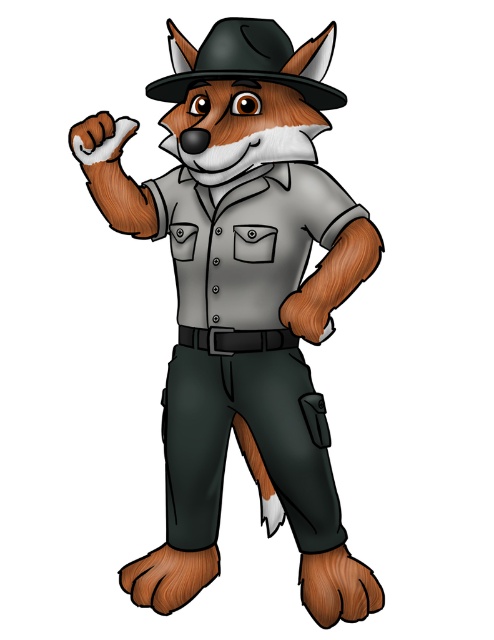
Question: Which point is farther to the camera?

Choices:
 (A) (294, 253)
 (B) (304, 524)

Answer: (B)

Question: Among these objects, which one is nearest to the camera?

Choices:
 (A) matte black pocket at center
 (B) dark gray fabric pocket at lower center
 (C) gray matte uniform at center
 (D) matte gray uniform at center

Answer: (D)

Question: Which of the following is the closest to the observer?

Choices:
 (A) black matte fedora at upper center
 (B) matte gray pocket at center
 (C) gray matte uniform at center

Answer: (A)

Question: Observing the image, what is the correct spatial positioning of dark gray fabric pocket at lower center in reference to matte gray pocket at center?

Choices:
 (A) left
 (B) right

Answer: (B)

Question: Can you confirm if dark gray fabric pocket at lower center is positioned to the right of matte gray pocket at center?

Choices:
 (A) no
 (B) yes

Answer: (B)

Question: Can you confirm if matte gray uniform at center is positioned below gray matte uniform at center?

Choices:
 (A) no
 (B) yes

Answer: (A)